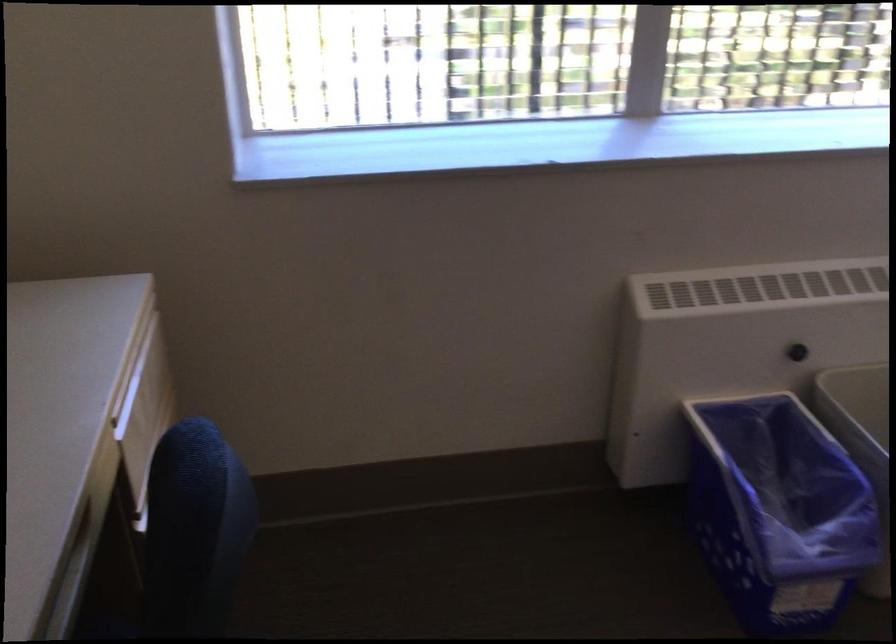
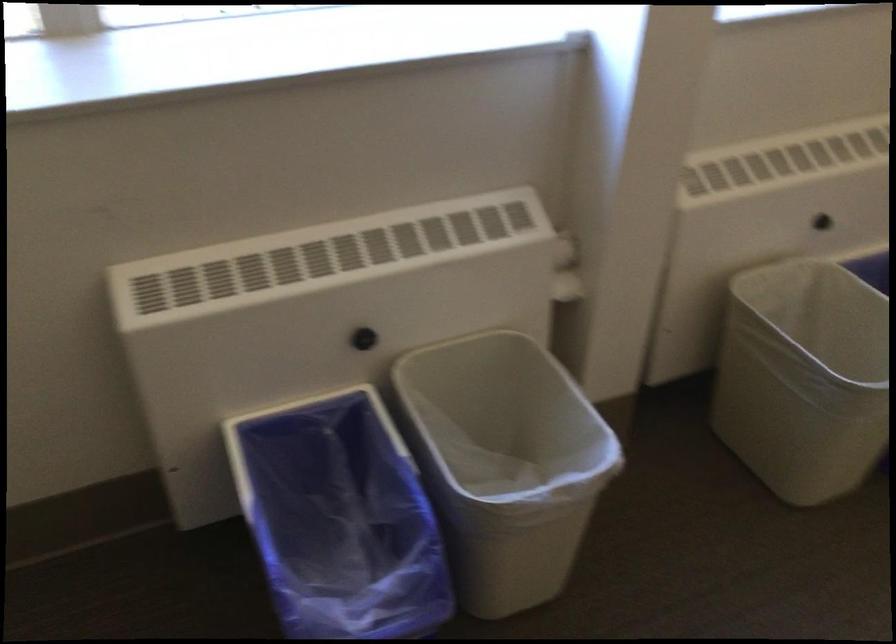
What movement of the cameraman would produce the second image?

The movement direction of the cameraman is right, forward.